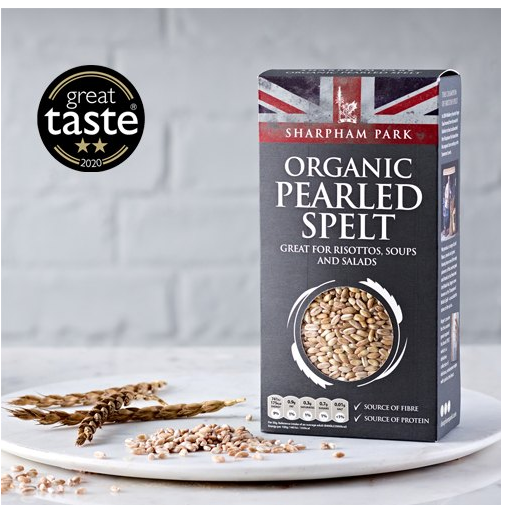
Find the location of a particular element. Image resolution: width=507 pixels, height=517 pixels. white plate is located at coordinates (284, 473).